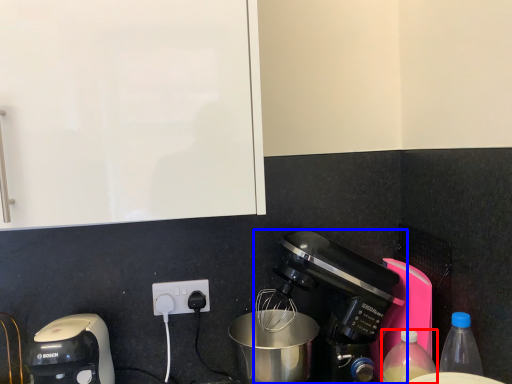
Question: Which of the following is the closest to the observer, bottle (highlighted by a red box) or coffee maker (highlighted by a blue box)?

Choices:
 (A) bottle
 (B) coffee maker

Answer: (A)